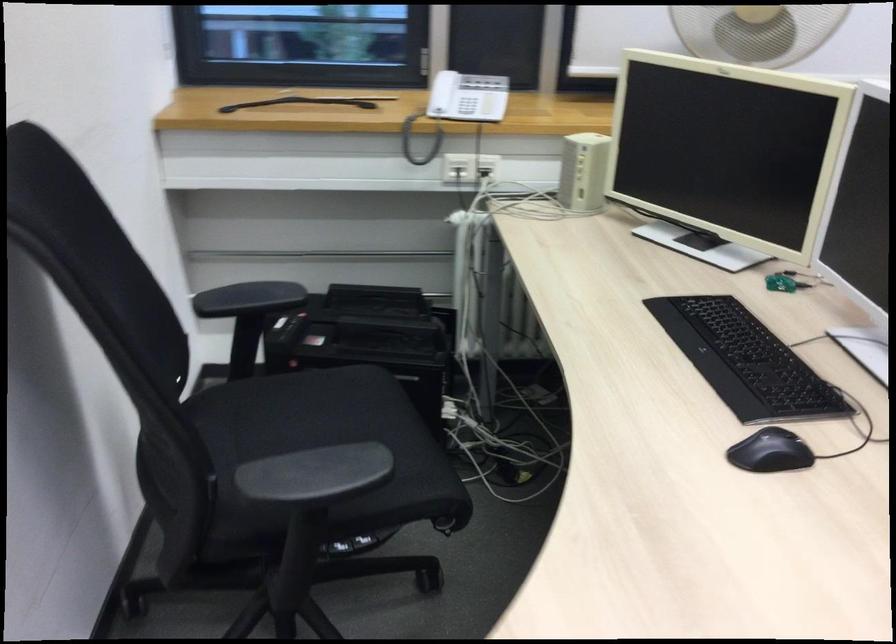
I want to click on white telephone handset, so click(459, 106).